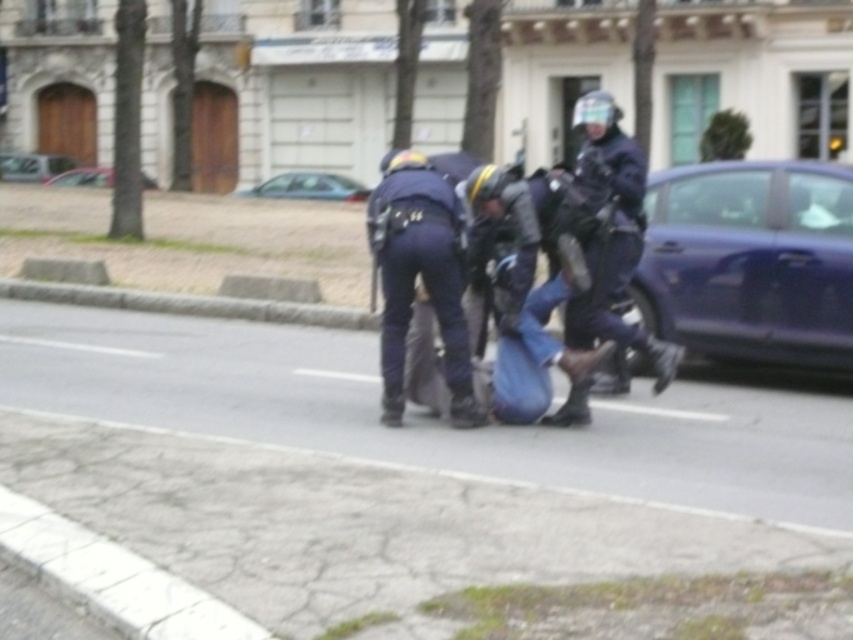
Question: Which of the following is the farthest from the observer?

Choices:
 (A) metallic silver car at center
 (B) metallic blue sedan at right
 (C) metallic blue sedan at center
 (D) dark blue uniform at center

Answer: (C)

Question: Is metallic blue sedan at right above dark blue uniform at center?

Choices:
 (A) no
 (B) yes

Answer: (A)

Question: Does dark blue uniform at center have a lesser width compared to metallic silver car at center?

Choices:
 (A) no
 (B) yes

Answer: (B)

Question: Which point is farther from the camera taking this photo?

Choices:
 (A) (20, 163)
 (B) (341, 196)

Answer: (A)

Question: Does metallic blue sedan at right appear on the left side of silver metallic car at upper left?

Choices:
 (A) no
 (B) yes

Answer: (A)

Question: Which object is farther from the camera taking this photo?

Choices:
 (A) metallic blue sedan at center
 (B) metallic blue sedan at right

Answer: (A)